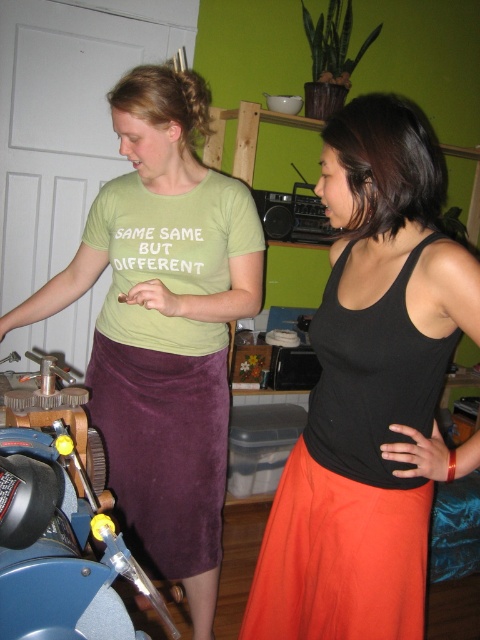
Question: Estimate the real-world distances between objects in this image. Which object is closer to the velvet purple skirt at center?

Choices:
 (A) brushed metal motorcycle at lower left
 (B) black matte tank top at center

Answer: (B)

Question: Which point is farther from the camera taking this photo?

Choices:
 (A) (24, 460)
 (B) (339, 560)

Answer: (B)

Question: In this image, where is velvet purple skirt at center located relative to brushed metal motorcycle at lower left?

Choices:
 (A) left
 (B) right

Answer: (A)

Question: Where is black matte tank top at center located in relation to brushed metal motorcycle at lower left in the image?

Choices:
 (A) above
 (B) below

Answer: (A)

Question: Which object appears farthest from the camera in this image?

Choices:
 (A) velvet purple skirt at center
 (B) brushed metal motorcycle at lower left
 (C) black matte tank top at center

Answer: (A)

Question: Can you confirm if black matte tank top at center is smaller than brushed metal motorcycle at lower left?

Choices:
 (A) no
 (B) yes

Answer: (A)